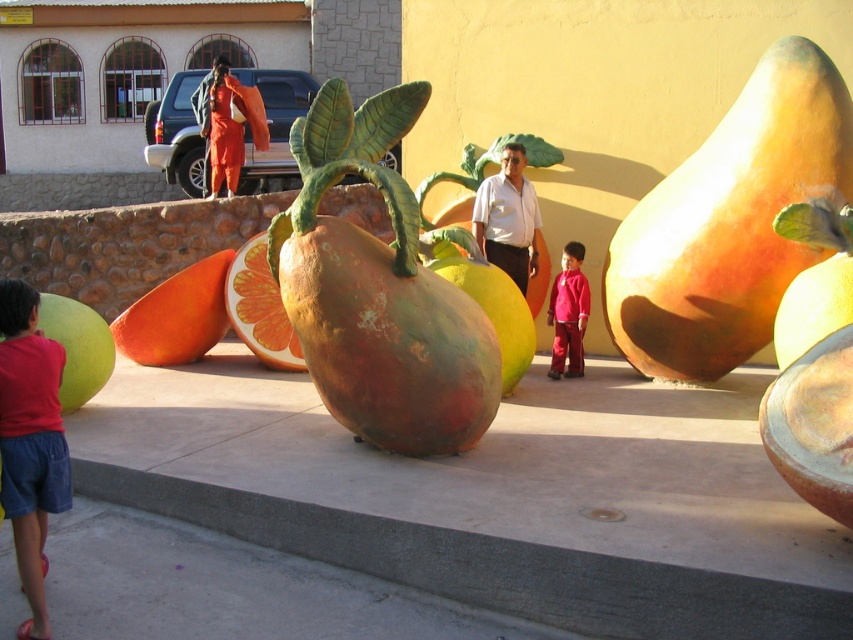
Can you confirm if matte orange squash at right is wider than orange matte grapefruit at center?

Yes, matte orange squash at right is wider than orange matte grapefruit at center.

Looking at this image, which is more to the left, matte orange squash at right or orange matte grapefruit at center?

orange matte grapefruit at center

Who is more distant from viewer, (x=625, y=257) or (x=241, y=301)?

The point (x=241, y=301) is more distant.

The width and height of the screenshot is (853, 640). I want to click on matte orange squash at right, so click(729, 221).

Between point (726, 275) and point (202, 324), which one is positioned in front?

Point (726, 275)

Can you confirm if matte orange squash at right is thinner than orange matte at center?

No.

Find the location of `matte orange squash at right`. matte orange squash at right is located at coordinates (729, 221).

The width and height of the screenshot is (853, 640). I want to click on matte orange squash at right, so click(729, 221).

Find the location of a particular element. The height and width of the screenshot is (640, 853). rustic wood fruit at center is located at coordinates (378, 291).

Does point (306, 291) come farther from viewer compared to point (161, 356)?

No.

At what (x,y) coordinates should I click in order to perform the action: click on rustic wood fruit at center. Please return your answer as a coordinate pair (x, y). This screenshot has width=853, height=640. Looking at the image, I should click on (378, 291).

Where is `rustic wood fruit at center`? The image size is (853, 640). rustic wood fruit at center is located at coordinates (378, 291).